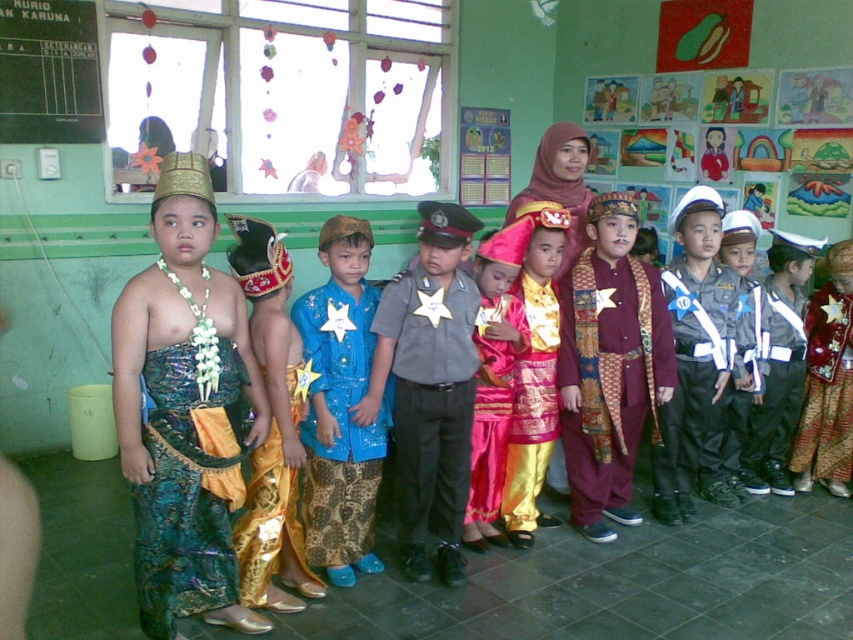
Question: Can you confirm if gray uniform at center is smaller than shiny gold pants at center?

Choices:
 (A) yes
 (B) no

Answer: (B)

Question: Among these points, which one is nearest to the camera?

Choices:
 (A) (144, 380)
 (B) (469, 353)
 (C) (693, 432)

Answer: (A)

Question: Can you confirm if shiny green fabric at center is thinner than maroon satin robe at center?

Choices:
 (A) no
 (B) yes

Answer: (B)

Question: Which of the following is the farthest from the observer?

Choices:
 (A) (65, 26)
 (B) (708, 220)
 (C) (248, 605)
 (D) (836, 392)

Answer: (D)

Question: Is shiny teal fabric dress at left wider than shiny gold fabric at right?

Choices:
 (A) no
 (B) yes

Answer: (B)

Question: Estimate the real-world distances between objects in this image. Which object is farther from the shiny gold pants at center?

Choices:
 (A) blackboard at upper left
 (B) maroon satin robe at center

Answer: (A)